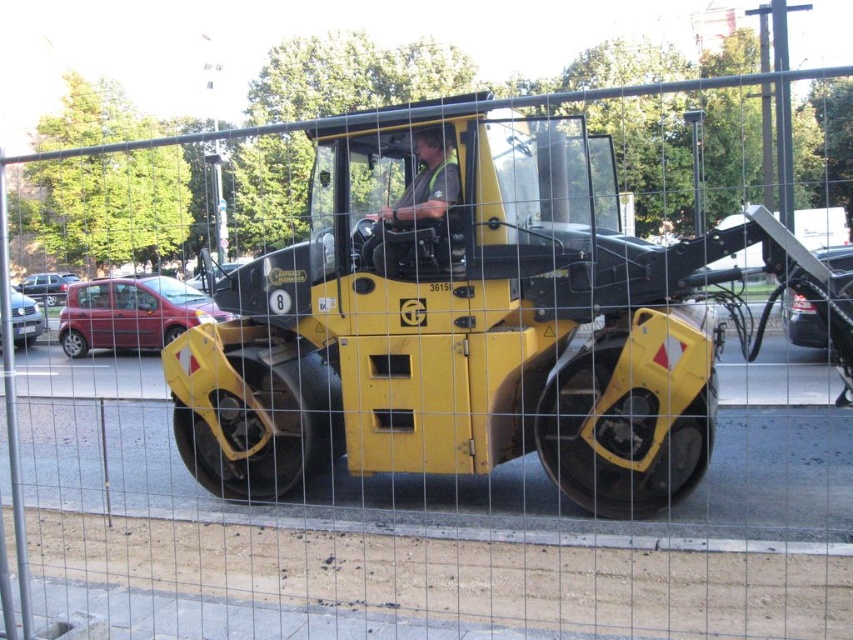
Can you confirm if yellow matte compactor at center is wider than green fabric construction worker at center?

Yes, yellow matte compactor at center is wider than green fabric construction worker at center.

Which is above, yellow matte compactor at center or green fabric construction worker at center?

green fabric construction worker at center is higher up.

Who is more forward, (335, 205) or (416, 152)?

Point (335, 205)

Find the location of `yellow matte compactor at center`. yellow matte compactor at center is located at coordinates click(469, 324).